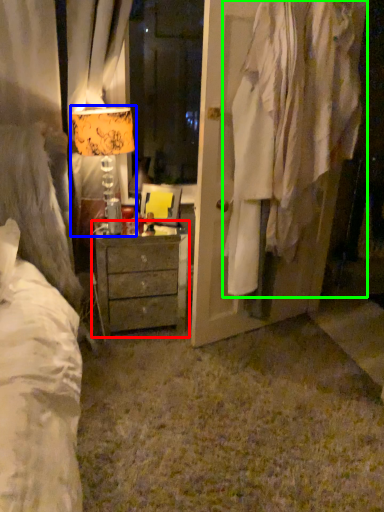
Question: Which object is positioned closest to chest of drawers (highlighted by a red box)? Select from table lamp (highlighted by a blue box) and clothing (highlighted by a green box).

Choices:
 (A) table lamp
 (B) clothing

Answer: (A)